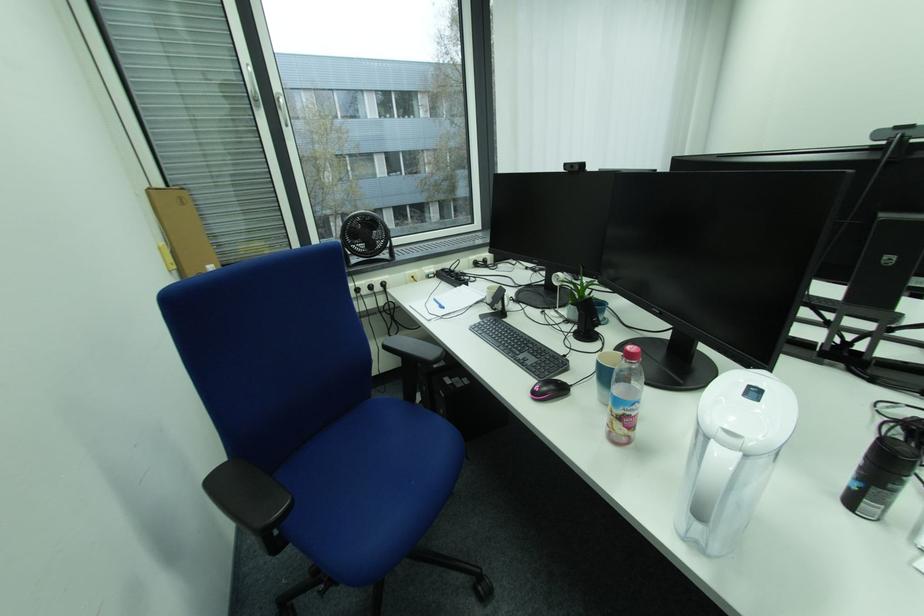
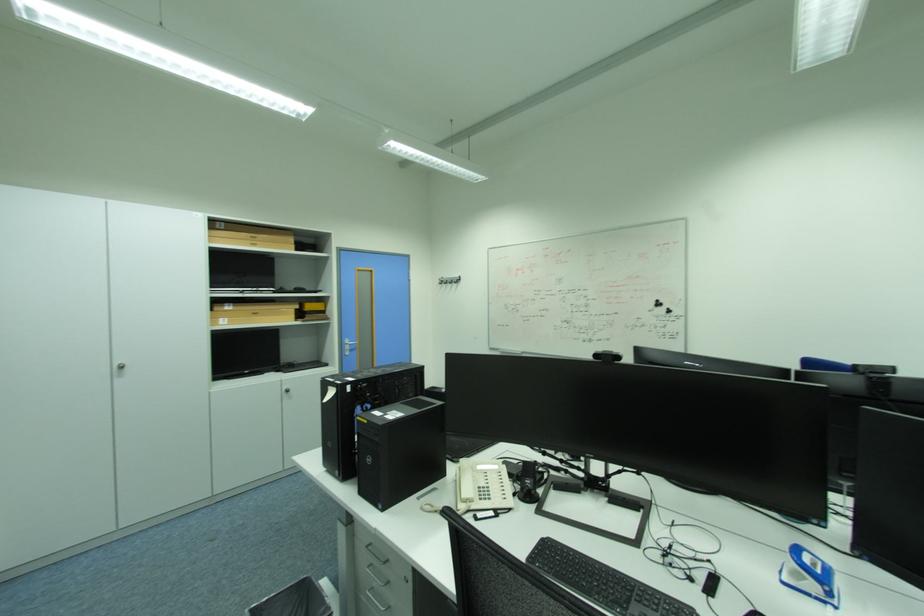
Question: I am providing you with two images of the same scene from different viewpoints. Which of the following objects are not visible in image2?

Choices:
 (A) black computer tower
 (B) black window handle
 (C) pink computer mouse
 (D) cardboard box

Answer: (C)